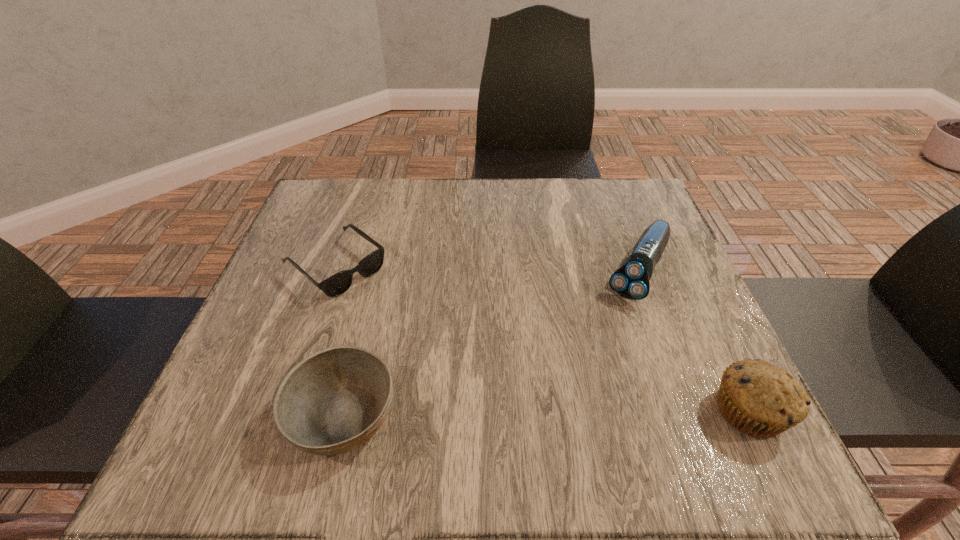
Image resolution: width=960 pixels, height=540 pixels. I want to click on vacant point that satisfies the following two spatial constraints: 1. on the front side of the shortest object; 2. on the right side of the third tallest object, so click(x=284, y=415).

You are a GUI agent. You are given a task and a screenshot of the screen. Output one action in this format:
    pyautogui.click(x=<x>, y=<y>)
    Task: Click on the vacant area that satisfies the following two spatial constraints: 1. on the front side of the shortest object; 2. on the left side of the third tallest object
    This screenshot has height=540, width=960.
    Given the screenshot: What is the action you would take?
    284,415